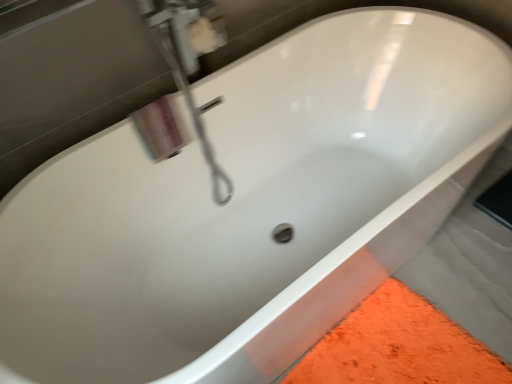
Question: Is polished chrome faucet at upper left, the 1th plumbing fixture from the front, oriented away from white glossy soap dispenser at upper left, the second plumbing fixture when ordered from front to back?

Choices:
 (A) yes
 (B) no

Answer: (B)

Question: From a real-world perspective, is polished chrome faucet at upper left, marked as the second plumbing fixture in a back-to-front arrangement, below white glossy soap dispenser at upper left, placed as the first plumbing fixture when sorted from back to front?

Choices:
 (A) no
 (B) yes

Answer: (B)

Question: Does polished chrome faucet at upper left, marked as the second plumbing fixture in a back-to-front arrangement, turn towards white glossy soap dispenser at upper left, the second plumbing fixture when ordered from front to back?

Choices:
 (A) yes
 (B) no

Answer: (B)

Question: From the image's perspective, is polished chrome faucet at upper left, the 1th plumbing fixture from the front, below white glossy soap dispenser at upper left, the second plumbing fixture when ordered from front to back?

Choices:
 (A) yes
 (B) no

Answer: (A)

Question: Are polished chrome faucet at upper left, marked as the second plumbing fixture in a back-to-front arrangement, and white glossy soap dispenser at upper left, the second plumbing fixture when ordered from front to back, located far from each other?

Choices:
 (A) yes
 (B) no

Answer: (B)

Question: Does polished chrome faucet at upper left, marked as the second plumbing fixture in a back-to-front arrangement, appear on the right side of white glossy soap dispenser at upper left, the second plumbing fixture when ordered from front to back?

Choices:
 (A) no
 (B) yes

Answer: (A)

Question: Is white glossy soap dispenser at upper left, the second plumbing fixture when ordered from front to back, wider than polished chrome faucet at upper left, marked as the second plumbing fixture in a back-to-front arrangement?

Choices:
 (A) yes
 (B) no

Answer: (B)

Question: Considering the relative sizes of white glossy soap dispenser at upper left, placed as the first plumbing fixture when sorted from back to front, and polished chrome faucet at upper left, the 1th plumbing fixture from the front, in the image provided, is white glossy soap dispenser at upper left, placed as the first plumbing fixture when sorted from back to front, bigger than polished chrome faucet at upper left, the 1th plumbing fixture from the front,?

Choices:
 (A) no
 (B) yes

Answer: (A)

Question: From a real-world perspective, is white glossy soap dispenser at upper left, placed as the first plumbing fixture when sorted from back to front, located higher than polished chrome faucet at upper left, the 1th plumbing fixture from the front?

Choices:
 (A) no
 (B) yes

Answer: (B)

Question: Does white glossy soap dispenser at upper left, placed as the first plumbing fixture when sorted from back to front, lie behind polished chrome faucet at upper left, marked as the second plumbing fixture in a back-to-front arrangement?

Choices:
 (A) yes
 (B) no

Answer: (A)

Question: Is white glossy soap dispenser at upper left, placed as the first plumbing fixture when sorted from back to front, thinner than polished chrome faucet at upper left, marked as the second plumbing fixture in a back-to-front arrangement?

Choices:
 (A) yes
 (B) no

Answer: (A)

Question: Is white glossy soap dispenser at upper left, the second plumbing fixture when ordered from front to back, to the left of polished chrome faucet at upper left, the 1th plumbing fixture from the front, from the viewer's perspective?

Choices:
 (A) no
 (B) yes

Answer: (A)

Question: Based on their positions, is polished chrome faucet at upper left, marked as the second plumbing fixture in a back-to-front arrangement, located to the left or right of white glossy soap dispenser at upper left, the second plumbing fixture when ordered from front to back?

Choices:
 (A) right
 (B) left

Answer: (B)